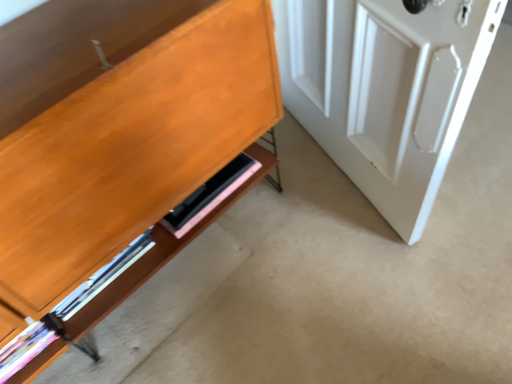
What do you see at coordinates (384, 91) in the screenshot? This screenshot has width=512, height=384. I see `white glossy door at right` at bounding box center [384, 91].

Where is `white glossy door at right`? This screenshot has width=512, height=384. white glossy door at right is located at coordinates (384, 91).

The image size is (512, 384). Describe the element at coordinates (209, 195) in the screenshot. I see `pink matte shelf at lower center` at that location.

What are the coordinates of `pink matte shelf at lower center` in the screenshot? It's located at (209, 195).

Where is `white glossy door at right`? The height and width of the screenshot is (384, 512). white glossy door at right is located at coordinates (384, 91).

Which object is positioned more to the left, pink matte shelf at lower center or white glossy door at right?

From the viewer's perspective, pink matte shelf at lower center appears more on the left side.

Which object is closer to the camera, pink matte shelf at lower center or white glossy door at right?

white glossy door at right is more forward.

Does point (184, 213) lie behind point (350, 3)?

Yes, it is behind point (350, 3).

From the image's perspective, between pink matte shelf at lower center and white glossy door at right, who is located below?

pink matte shelf at lower center.

From a real-world perspective, is pink matte shelf at lower center under white glossy door at right?

Indeed, from a real-world perspective, pink matte shelf at lower center is positioned beneath white glossy door at right.

In terms of width, does pink matte shelf at lower center look wider or thinner when compared to white glossy door at right?

Clearly, pink matte shelf at lower center has less width compared to white glossy door at right.

Considering the sizes of objects pink matte shelf at lower center and white glossy door at right in the image provided, who is shorter, pink matte shelf at lower center or white glossy door at right?

With less height is pink matte shelf at lower center.

Is pink matte shelf at lower center smaller than white glossy door at right?

Indeed, pink matte shelf at lower center has a smaller size compared to white glossy door at right.

Is pink matte shelf at lower center surrounding white glossy door at right?

That's incorrect, white glossy door at right is not inside pink matte shelf at lower center.

Is pink matte shelf at lower center far away from white glossy door at right?

No, pink matte shelf at lower center is not far from white glossy door at right.

Is pink matte shelf at lower center facing towards white glossy door at right?

No, pink matte shelf at lower center is not aimed at white glossy door at right.

How many degrees apart are the facing directions of pink matte shelf at lower center and white glossy door at right?

The facing directions of pink matte shelf at lower center and white glossy door at right are 72.8 degrees apart.

The width and height of the screenshot is (512, 384). In order to click on door that appears above the pink matte shelf at lower center (from the image's perspective) in this screenshot , I will do `click(384, 91)`.

Is white glossy door at right at the left side of pink matte shelf at lower center?

Incorrect, white glossy door at right is not on the left side of pink matte shelf at lower center.

Considering their positions, is white glossy door at right located in front of or behind pink matte shelf at lower center?

white glossy door at right is positioned closer to the viewer than pink matte shelf at lower center.

Does point (452, 47) lie behind point (195, 203)?

No, it is not.

From the image's perspective, between white glossy door at right and pink matte shelf at lower center, who is located below?

pink matte shelf at lower center appears lower in the image.

From a real-world perspective, which object stands above the other?

white glossy door at right is physically above.

Which object is thinner, white glossy door at right or pink matte shelf at lower center?

Thinner between the two is pink matte shelf at lower center.

Between white glossy door at right and pink matte shelf at lower center, which one has more height?

Standing taller between the two is white glossy door at right.

Can you confirm if white glossy door at right is smaller than pink matte shelf at lower center?

A: Actually, white glossy door at right might be larger than pink matte shelf at lower center.

Is white glossy door at right inside or outside of pink matte shelf at lower center?

white glossy door at right exists outside the volume of pink matte shelf at lower center.

Is there a large distance between white glossy door at right and pink matte shelf at lower center?

No, white glossy door at right is not far from pink matte shelf at lower center.

Is pink matte shelf at lower center at the back of white glossy door at right?

That's right, white glossy door at right is facing away from pink matte shelf at lower center.

Can you tell me how much white glossy door at right and pink matte shelf at lower center differ in facing direction?

The angle between the facing direction of white glossy door at right and the facing direction of pink matte shelf at lower center is 72.8 degrees.

I want to click on shelf lying behind the white glossy door at right, so [209, 195].

Locate an element on the screen. The height and width of the screenshot is (384, 512). door above the pink matte shelf at lower center (from the image's perspective) is located at coordinates (384, 91).

I want to click on shelf below the white glossy door at right (from the image's perspective), so click(x=209, y=195).